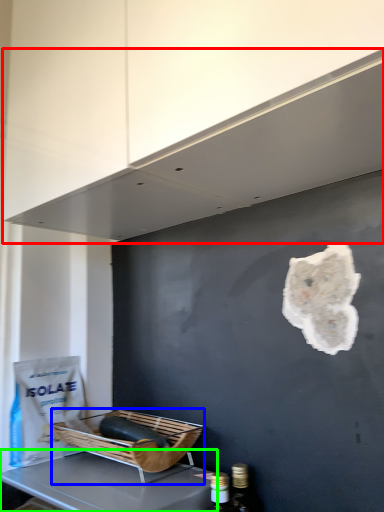
Question: Based on their relative distances, which object is farther from exhaust hood (highlighted by a red box)? Choose from basket (highlighted by a blue box) and furniture (highlighted by a green box).

Choices:
 (A) basket
 (B) furniture

Answer: (B)